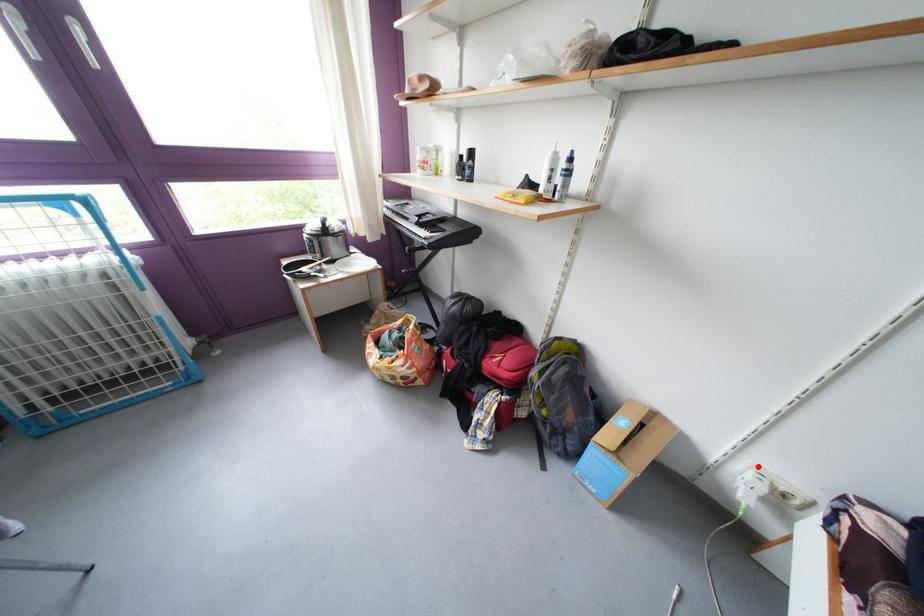
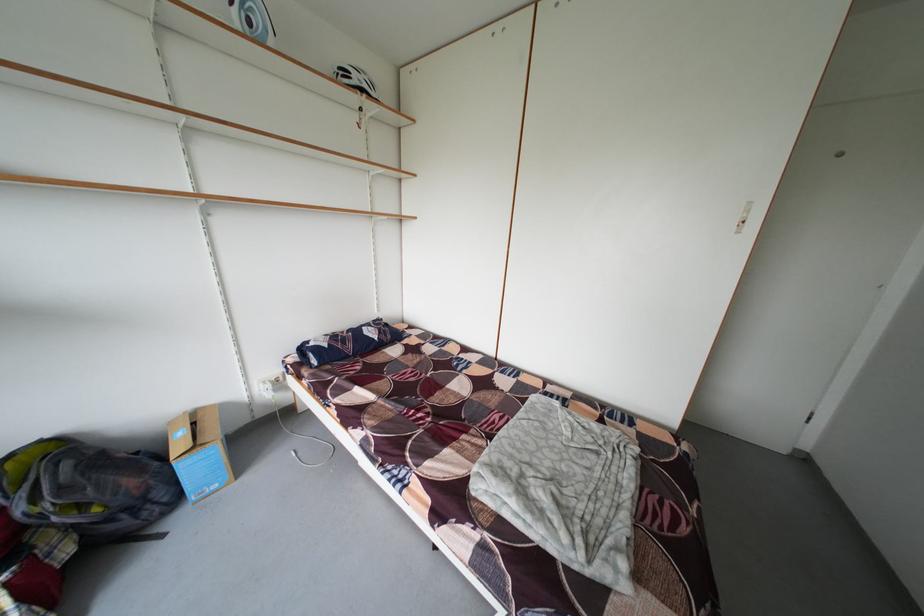
In the second image, find the point that corresponds to the highlighted location in the first image.

(265, 387)